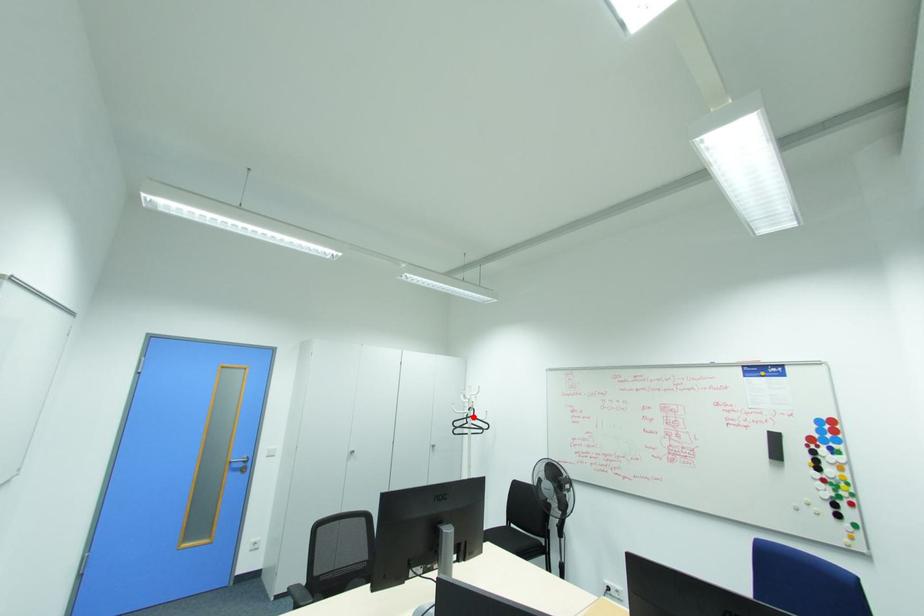
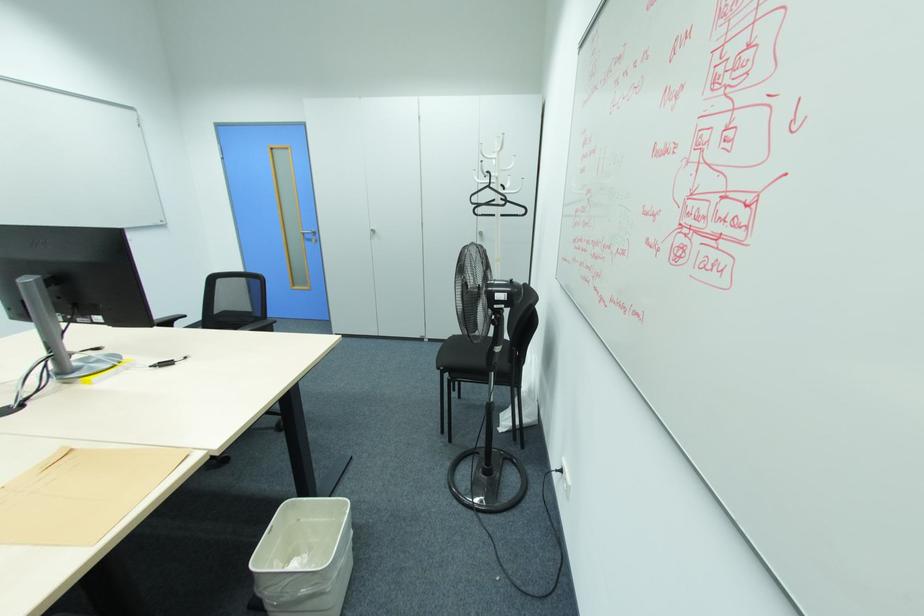
In the second image, find the point that corresponds to the highlighted location in the first image.

(490, 187)